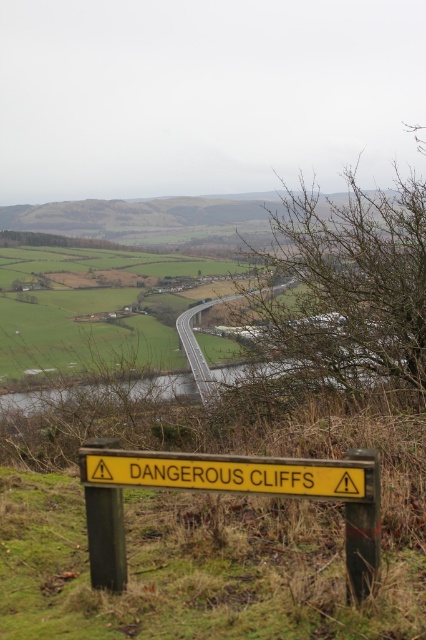
You are a driver approaching the yellow wooden sign at lower center. Based on its position at point coordinates, can you estimate how far the sign is from the road?

The yellow wooden sign at lower center is positioned at coordinates point (227,490), which indicates it is relatively close to the road, likely within a short distance for visibility but not directly on the road itself.